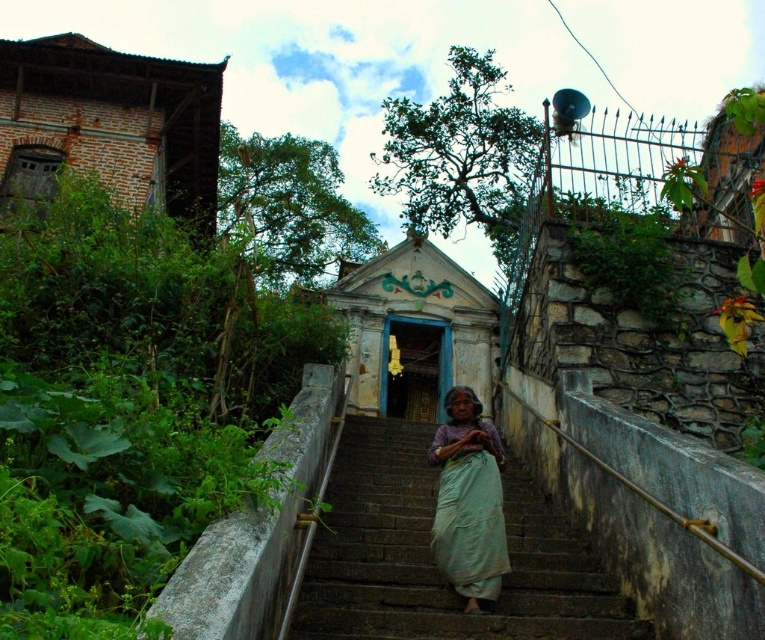
Question: Observing the image, what is the correct spatial positioning of brown stone stairs at center in reference to light green fabric at center?

Choices:
 (A) below
 (B) above

Answer: (A)

Question: Among these objects, which one is farthest from the camera?

Choices:
 (A) light green fabric at center
 (B) brown stone stairs at center

Answer: (A)

Question: Among these points, which one is farthest from the camera?

Choices:
 (A) (363, 461)
 (B) (479, 426)

Answer: (A)

Question: Can you confirm if brown stone stairs at center is bigger than light green fabric at center?

Choices:
 (A) yes
 (B) no

Answer: (A)

Question: Does brown stone stairs at center appear on the right side of light green fabric at center?

Choices:
 (A) yes
 (B) no

Answer: (B)

Question: Which point is farther from the camera taking this photo?

Choices:
 (A) (523, 604)
 (B) (444, 522)

Answer: (B)